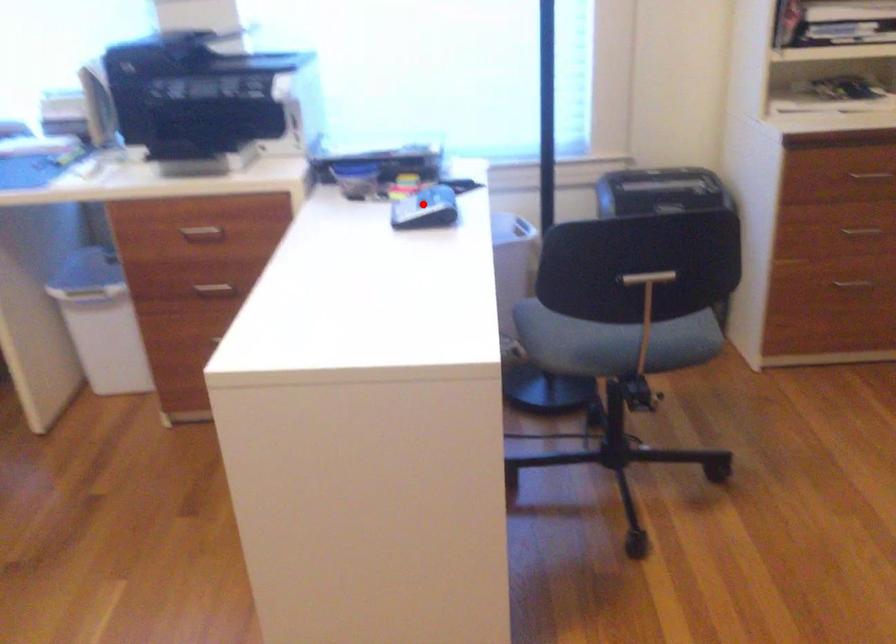
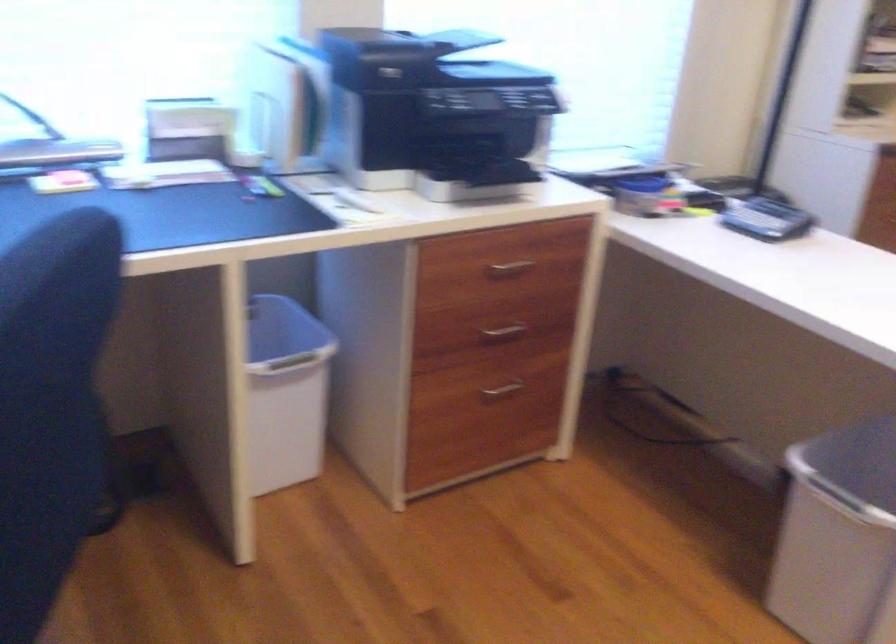
Locate, in the second image, the point that corresponds to the highlighted location in the first image.

(767, 220)